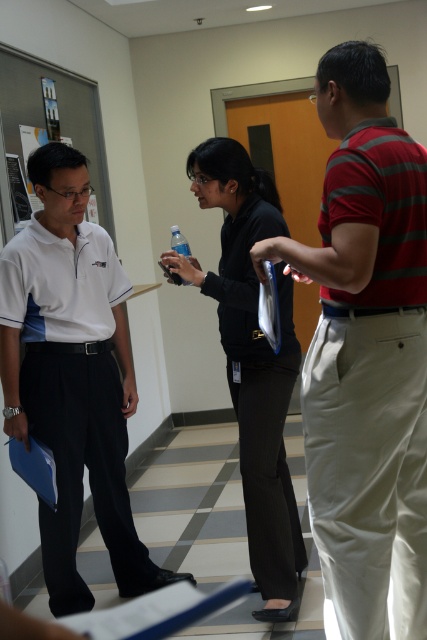
Question: Among these points, which one is farthest from the camera?

Choices:
 (A) (295, 579)
 (B) (93, 225)
 (C) (178, 228)
 (D) (9, 262)

Answer: (C)

Question: Which point appears closest to the camera in this image?

Choices:
 (A) (348, 528)
 (B) (287, 355)
 (C) (44, 285)
 (D) (186, 243)

Answer: (A)

Question: Which object is closer to the camera taking this photo?

Choices:
 (A) white smooth polo shirt at left
 (B) black matte pants at center

Answer: (A)

Question: Does striped cotton polo shirt at right appear on the left side of white matte polo shirt at left?

Choices:
 (A) no
 (B) yes

Answer: (A)

Question: Considering the relative positions of striped cotton polo shirt at right and clear plastic bottle at center in the image provided, where is striped cotton polo shirt at right located with respect to clear plastic bottle at center?

Choices:
 (A) right
 (B) left

Answer: (A)

Question: Is striped cotton polo shirt at right smaller than white smooth polo shirt at left?

Choices:
 (A) yes
 (B) no

Answer: (A)